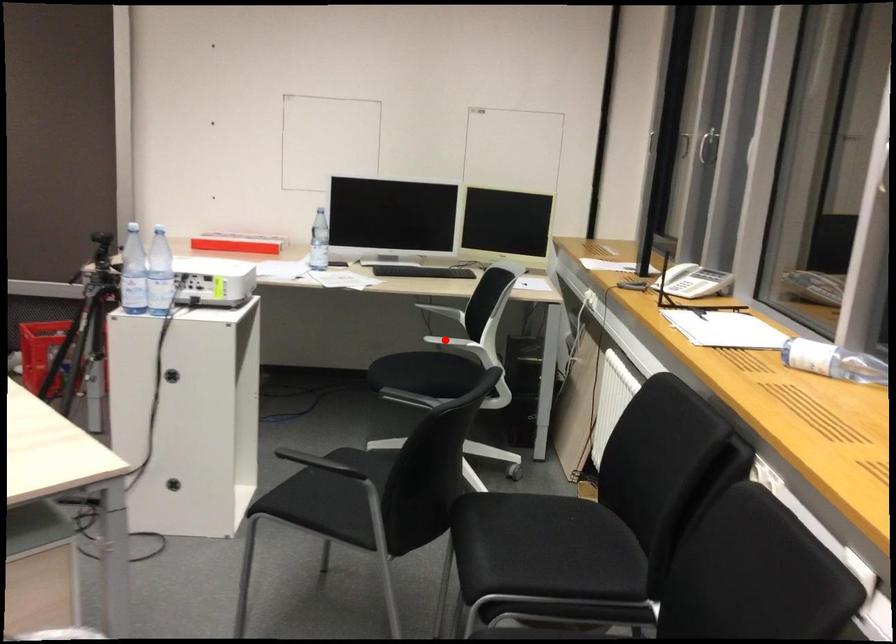
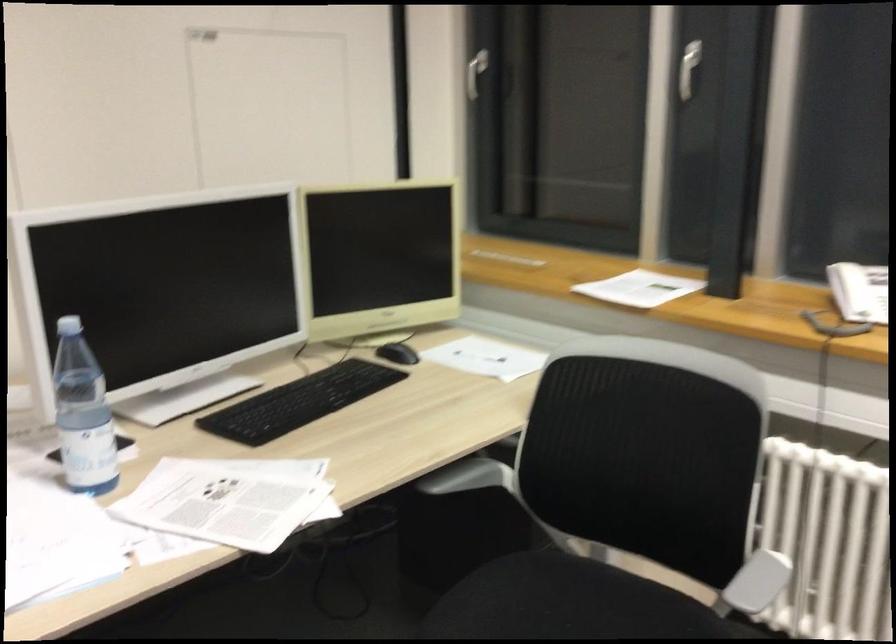
Find the pixel in the second image that matches the highlighted location in the first image.

(757, 582)